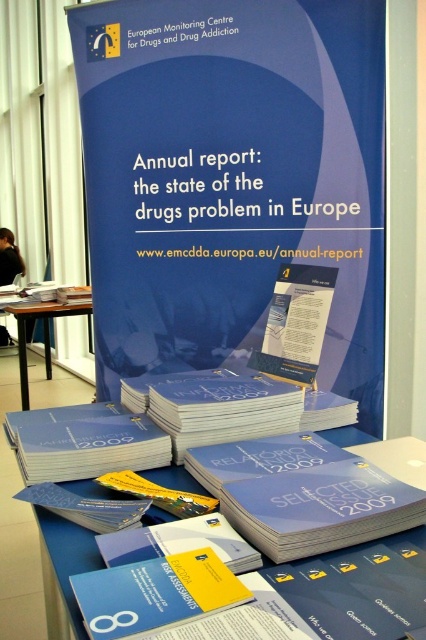
You are a conference attendee standing in front of the large blue banner. You need to pick up the blue paper booklet at center. Where should you look to find it?

The blue paper booklet at center is located at the 2D coordinates point (304,493), so you should look there to find it.

You are standing in front of the conference display and see the point marked at coordinates (155, 593). What object is located at this point?

The point at coordinates (155, 593) marks the blue paper book at center.

In the scene shown: You are at a conference and need to pick up a blue paper at center. Where should you go relative to the wooden table at lower left?

The blue paper at center is above the wooden table at lower left, so you should go to the area above the wooden table at lower left to pick it up.